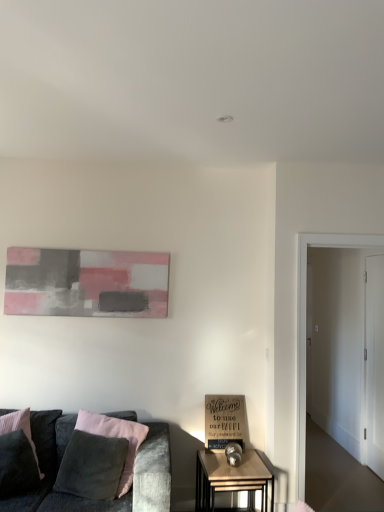
Question: Does wooden side table at lower center have a lesser height compared to wooden signboard at lower center?

Choices:
 (A) yes
 (B) no

Answer: (B)

Question: Is wooden side table at lower center closer to the viewer compared to wooden signboard at lower center?

Choices:
 (A) yes
 (B) no

Answer: (A)

Question: From the image's perspective, is wooden side table at lower center on top of wooden signboard at lower center?

Choices:
 (A) no
 (B) yes

Answer: (A)

Question: Is wooden side table at lower center facing away from wooden signboard at lower center?

Choices:
 (A) no
 (B) yes

Answer: (A)

Question: Does wooden side table at lower center have a greater width compared to wooden signboard at lower center?

Choices:
 (A) no
 (B) yes

Answer: (B)

Question: Does wooden side table at lower center appear on the left side of wooden signboard at lower center?

Choices:
 (A) yes
 (B) no

Answer: (B)

Question: Can you confirm if dark gray fabric pillow at lower left is taller than white glossy door at right, marked as the first glass door in a left-to-right arrangement?

Choices:
 (A) yes
 (B) no

Answer: (B)

Question: Can you confirm if dark gray fabric pillow at lower left is bigger than white glossy door at right, marked as the 2th glass door in a back-to-front arrangement?

Choices:
 (A) yes
 (B) no

Answer: (B)

Question: Is dark gray fabric pillow at lower left at the left side of white glossy door at right, which ranks as the first glass door in front-to-back order?

Choices:
 (A) no
 (B) yes

Answer: (B)

Question: Does dark gray fabric pillow at lower left have a greater width compared to white glossy door at right, which ranks as the first glass door in front-to-back order?

Choices:
 (A) yes
 (B) no

Answer: (A)

Question: From the image's perspective, is dark gray fabric pillow at lower left located beneath white glossy door at right, marked as the 2th glass door in a back-to-front arrangement?

Choices:
 (A) yes
 (B) no

Answer: (A)

Question: From the image's perspective, would you say dark gray fabric pillow at lower left is positioned over white glossy door at right, which ranks as the first glass door in front-to-back order?

Choices:
 (A) no
 (B) yes

Answer: (A)

Question: Is white glossy door at right, marked as the first glass door in a left-to-right arrangement, oriented towards white glossy door at right, the second glass door viewed from the front?

Choices:
 (A) yes
 (B) no

Answer: (B)